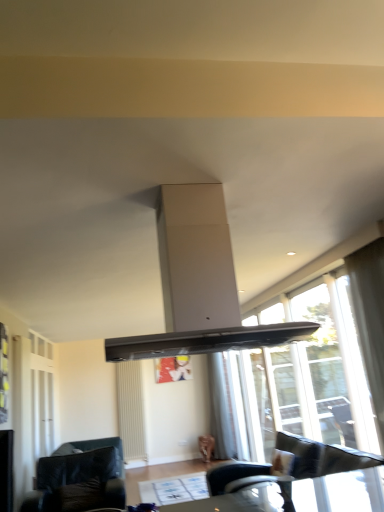
Question: Is black leather couch at lower left closer to camera compared to white matte exhaust hood at center?

Choices:
 (A) no
 (B) yes

Answer: (A)

Question: From the image's perspective, is black leather couch at lower left above white matte exhaust hood at center?

Choices:
 (A) no
 (B) yes

Answer: (A)

Question: Is black leather couch at lower left placed right next to white matte exhaust hood at center?

Choices:
 (A) no
 (B) yes

Answer: (A)

Question: Is black leather couch at lower left not within white matte exhaust hood at center?

Choices:
 (A) no
 (B) yes

Answer: (B)

Question: Is black leather couch at lower left bigger than white matte exhaust hood at center?

Choices:
 (A) no
 (B) yes

Answer: (B)

Question: Considering the relative sizes of black leather couch at lower left and white matte exhaust hood at center in the image provided, is black leather couch at lower left thinner than white matte exhaust hood at center?

Choices:
 (A) yes
 (B) no

Answer: (B)

Question: Does matte black table at lower center come in front of white matte exhaust hood at center?

Choices:
 (A) yes
 (B) no

Answer: (B)

Question: Is white matte exhaust hood at center at the back of matte black table at lower center?

Choices:
 (A) no
 (B) yes

Answer: (A)

Question: Is matte black table at lower center in contact with white matte exhaust hood at center?

Choices:
 (A) yes
 (B) no

Answer: (B)

Question: Is white matte exhaust hood at center a part of matte black table at lower center?

Choices:
 (A) yes
 (B) no

Answer: (B)

Question: Is matte black table at lower center positioned beyond the bounds of white matte exhaust hood at center?

Choices:
 (A) yes
 (B) no

Answer: (A)

Question: From the image's perspective, is matte black table at lower center below white matte exhaust hood at center?

Choices:
 (A) no
 (B) yes

Answer: (B)

Question: Is white matte exhaust hood at center directly adjacent to white matte radiator at lower left?

Choices:
 (A) yes
 (B) no

Answer: (B)